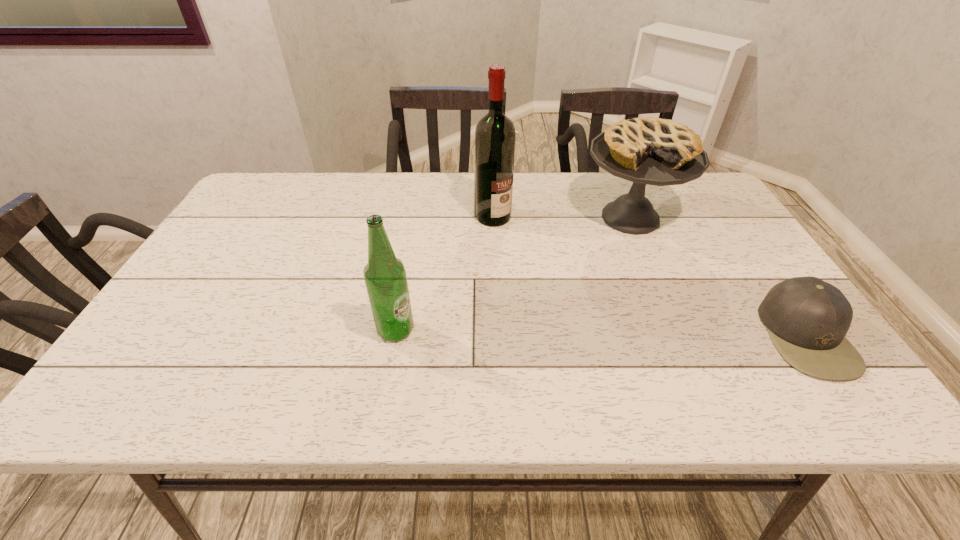
Where is `cap that is at the right edge`? cap that is at the right edge is located at coordinates (807, 318).

At what (x,y) coordinates should I click in order to perform the action: click on pie that is at the right edge. Please return your answer as a coordinate pair (x, y). Looking at the image, I should click on (653, 151).

I want to click on object situated at the far right corner, so click(x=653, y=151).

Locate an element on the screen. object situated at the near right corner is located at coordinates (807, 318).

You are a GUI agent. You are given a task and a screenshot of the screen. Output one action in this format:
    pyautogui.click(x=<x>, y=<y>)
    Task: Click on the free space at the far edge of the desktop
    The width and height of the screenshot is (960, 540).
    Given the screenshot: What is the action you would take?
    pyautogui.click(x=570, y=172)

Where is `free space at the near edge`? The image size is (960, 540). free space at the near edge is located at coordinates (242, 367).

The image size is (960, 540). In the image, there is a desktop. Find the location of `free region at the left edge`. free region at the left edge is located at coordinates (218, 246).

Where is `blank area at the far left corner`? The image size is (960, 540). blank area at the far left corner is located at coordinates (248, 211).

At what (x,y) coordinates should I click in order to perform the action: click on vacant region at the near left corner. Please return your answer as a coordinate pair (x, y). The image size is (960, 540). Looking at the image, I should click on (186, 357).

Where is `free space at the far right corner of the desktop`? free space at the far right corner of the desktop is located at coordinates (684, 202).